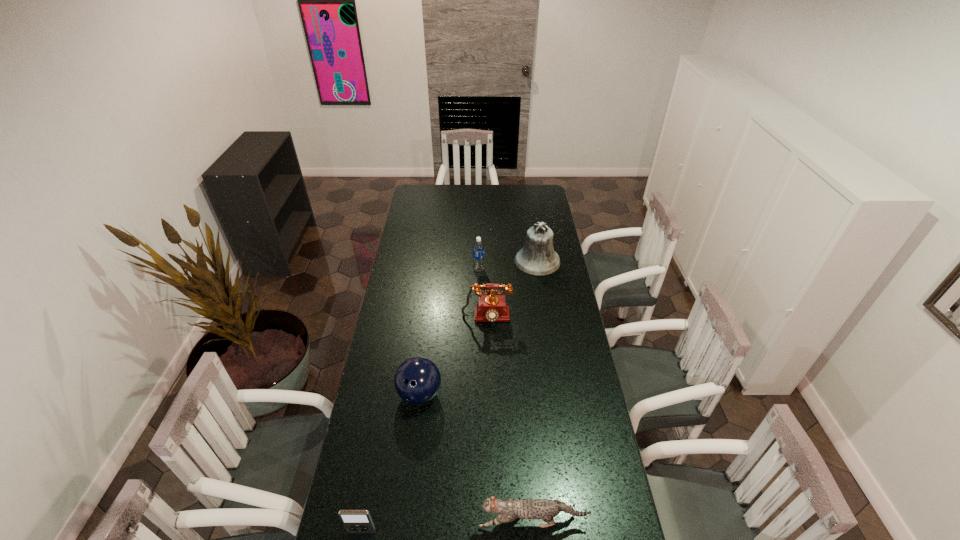
The width and height of the screenshot is (960, 540). I want to click on vacant area situated 0.150m on the face of the cat, so click(428, 522).

At what (x,y) coordinates should I click in order to perform the action: click on free space located 0.050m on the face of the cat. Please return your answer as a coordinate pair (x, y). The width and height of the screenshot is (960, 540). Looking at the image, I should click on [462, 522].

Where is `free space located 0.360m on the face of the cat`? The image size is (960, 540). free space located 0.360m on the face of the cat is located at coordinates (358, 522).

Identify the location of bowling ball that is at the left edge. (417, 380).

Image resolution: width=960 pixels, height=540 pixels. I want to click on iPod that is at the left edge, so click(x=355, y=521).

Where is `bell located at the right edge`? bell located at the right edge is located at coordinates (538, 258).

Where is `cat at the right edge`? This screenshot has width=960, height=540. cat at the right edge is located at coordinates (510, 509).

This screenshot has height=540, width=960. What are the coordinates of `vacant region at the far edge of the desktop` in the screenshot? It's located at (487, 188).

Identify the location of vacant region at the left edge of the desktop. The image size is (960, 540). (395, 272).

The width and height of the screenshot is (960, 540). I want to click on vacant space at the right edge of the desktop, so click(590, 443).